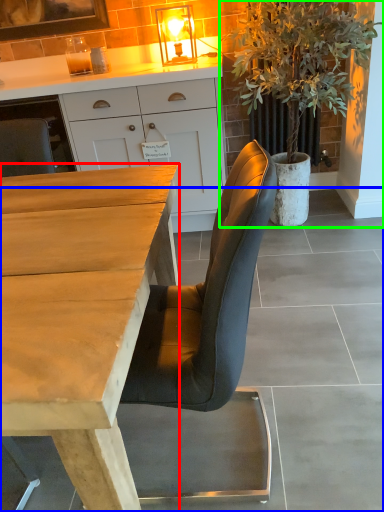
Question: Which object is positioned farthest from desk (highlighted by a red box)? Select from concrete (highlighted by a blue box) and houseplant (highlighted by a green box).

Choices:
 (A) concrete
 (B) houseplant

Answer: (B)